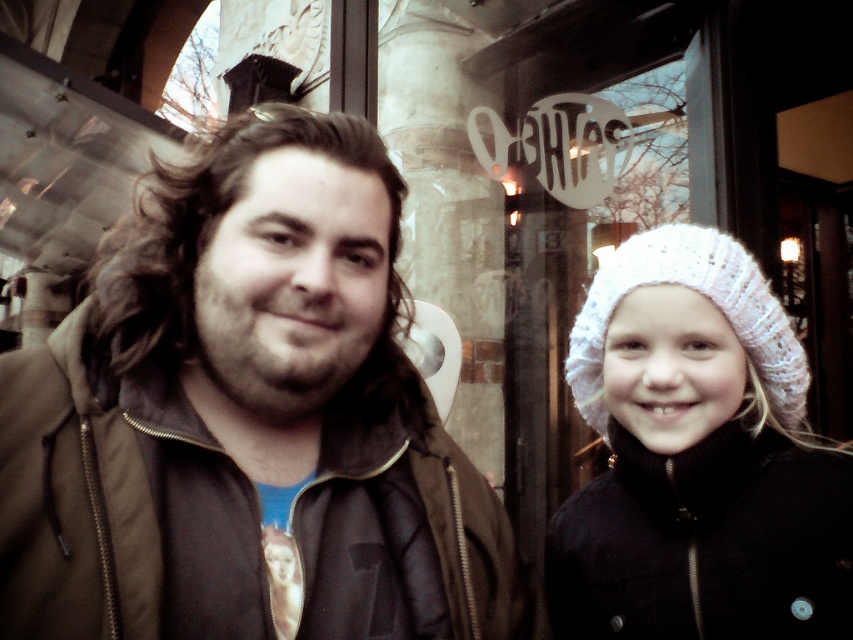
Is brown matte jacket at center to the left of white knitted hat at right from the viewer's perspective?

Correct, you'll find brown matte jacket at center to the left of white knitted hat at right.

Who is lower down, brown matte jacket at center or white knitted hat at right?

brown matte jacket at center is lower down.

Which is behind, point (74, 314) or point (595, 422)?

The point (595, 422) is behind.

This screenshot has width=853, height=640. Identify the location of brown matte jacket at center. (247, 420).

Does brown matte jacket at center have a greater width compared to white knitted beret at upper right?

Yes.

In the scene shown: Can you confirm if brown matte jacket at center is positioned above white knitted beret at upper right?

Correct, brown matte jacket at center is located above white knitted beret at upper right.

This screenshot has height=640, width=853. Identify the location of brown matte jacket at center. (247, 420).

Is white knitted beret at upper right bigger than white knitted hat at right?

Correct, white knitted beret at upper right is larger in size than white knitted hat at right.

How distant is white knitted beret at upper right from white knitted hat at right?

A distance of 4.57 inches exists between white knitted beret at upper right and white knitted hat at right.

Is point (608, 579) more distant than point (715, 240)?

That is True.

Image resolution: width=853 pixels, height=640 pixels. In order to click on white knitted beret at upper right in this screenshot , I will do `click(698, 458)`.